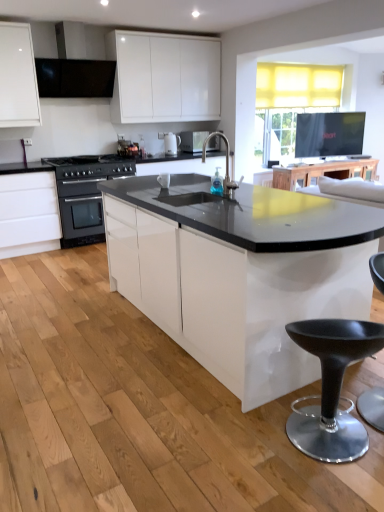
This screenshot has width=384, height=512. Describe the element at coordinates (85, 194) in the screenshot. I see `black stainless steel oven at left` at that location.

The image size is (384, 512). What do you see at coordinates (74, 68) in the screenshot?
I see `black matte exhaust hood at upper left` at bounding box center [74, 68].

I want to click on black plastic stool at lower right, so click(x=332, y=388).

Find the location of a particular element. The image size is (384, 512). white glossy cabinet at left is located at coordinates (28, 214).

Describe the element at coordinates (170, 143) in the screenshot. I see `white glossy coffee machine at center` at that location.

Image resolution: width=384 pixels, height=512 pixels. I want to click on white glossy coffee machine at center, so click(170, 143).

Describe the element at coordinates (226, 163) in the screenshot. I see `translucent glass faucet at center` at that location.

Identify the location of black stainless steel oven at left. (85, 194).

Is translucent glass faucet at center next to wooden table at upper center?

No.

From a real-world perspective, does translucent glass faucet at center stand above wooden table at upper center?

Indeed, from a real-world perspective, translucent glass faucet at center stands above wooden table at upper center.

In the scene shown: Considering the relative positions of translucent glass faucet at center and wooden table at upper center in the image provided, is translucent glass faucet at center to the left or to the right of wooden table at upper center?

translucent glass faucet at center is positioned on wooden table at upper center's left side.

Could you tell me if translucent glass faucet at center is turned towards wooden table at upper center?

No, translucent glass faucet at center is not turned towards wooden table at upper center.

From a real-world perspective, between black stainless steel oven at left and black plastic stool at lower right, who is vertically lower?

black plastic stool at lower right is physically lower.

Is black stainless steel oven at left oriented towards black plastic stool at lower right?

Yes, black stainless steel oven at left is turned towards black plastic stool at lower right.

Is black stainless steel oven at left not inside black plastic stool at lower right?

Absolutely, black stainless steel oven at left is external to black plastic stool at lower right.

Does black stainless steel oven at left come behind black plastic stool at lower right?

Yes.

Based on the photo, from a real-world perspective, which is physically above, black matte exhaust hood at upper left or wooden table at upper center?

black matte exhaust hood at upper left.

Is black matte exhaust hood at upper left far from wooden table at upper center?

Yes.

Which is in front, black matte exhaust hood at upper left or wooden table at upper center?

black matte exhaust hood at upper left is more forward.

From the image's perspective, which one is positioned higher, black matte exhaust hood at upper left or wooden table at upper center?

From the image's view, black matte exhaust hood at upper left is above.

Can you tell me how much black plastic swivel chair at lower right and white glossy coffee machine at center differ in facing direction?

black plastic swivel chair at lower right and white glossy coffee machine at center are facing 22.9 degrees away from each other.

Based on their sizes in the image, would you say black plastic swivel chair at lower right is bigger or smaller than white glossy coffee machine at center?

Clearly, black plastic swivel chair at lower right is larger in size than white glossy coffee machine at center.

Considering the sizes of objects black plastic swivel chair at lower right and white glossy coffee machine at center in the image provided, who is wider, black plastic swivel chair at lower right or white glossy coffee machine at center?

black plastic swivel chair at lower right is wider.

This screenshot has height=512, width=384. In the image, there is a black plastic swivel chair at lower right. In order to click on coffee machine above it (from the image's perspective) in this screenshot , I will do `click(170, 143)`.

Which of these two, translucent glass faucet at center or white glossy cabinet at left, is wider?

With larger width is white glossy cabinet at left.

From a real-world perspective, which is physically below, translucent glass faucet at center or white glossy cabinet at left?

In real-world perspective, white glossy cabinet at left is lower.

Which is correct: translucent glass faucet at center is inside white glossy cabinet at left, or outside of it?

translucent glass faucet at center cannot be found inside white glossy cabinet at left.

In terms of size, does translucent glass faucet at center appear bigger or smaller than white glossy cabinet at left?

Clearly, translucent glass faucet at center is smaller in size than white glossy cabinet at left.

From a real-world perspective, is white glossy coffee machine at center positioned under matte black microwave at center based on gravity?

Incorrect, from a real-world perspective, white glossy coffee machine at center is higher than matte black microwave at center.

Does white glossy coffee machine at center have a greater width compared to matte black microwave at center?

Incorrect, the width of white glossy coffee machine at center does not surpass that of matte black microwave at center.

Is white glossy coffee machine at center turned away from matte black microwave at center?

No, white glossy coffee machine at center is not facing the opposite direction of matte black microwave at center.

Would you say white glossy coffee machine at center is outside matte black microwave at center?

Yes.

Is black stainless steel oven at left positioned with its back to wooden table at upper center?

No, black stainless steel oven at left is not facing the opposite direction of wooden table at upper center.

Does point (65, 203) come behind point (342, 169)?

No, it is not.

From the image's perspective, is black stainless steel oven at left beneath wooden table at upper center?

Yes, from the image's perspective, black stainless steel oven at left is beneath wooden table at upper center.

The height and width of the screenshot is (512, 384). Find the location of `open lying on the left of wooden table at upper center`. open lying on the left of wooden table at upper center is located at coordinates (226, 163).

Identify the location of bar stool below the black stainless steel oven at left (from the image's perspective). (332, 388).

Estimate the real-world distances between objects in this image. Which object is further from black plastic swivel chair at lower right, white glossy cabinet at left or matte black microwave at center?

matte black microwave at center is positioned further to the anchor black plastic swivel chair at lower right.

Based on their spatial positions, is black plastic stool at lower right or matte black microwave at center closer to black plastic swivel chair at lower right?

black plastic stool at lower right is closer to black plastic swivel chair at lower right.

Looking at the image, which one is located further to black matte exhaust hood at upper left, translucent glass faucet at center or white glossy cabinet at left?

translucent glass faucet at center.

Based on the photo, considering their positions, is matte black microwave at center positioned closer to white glossy cabinet at left than black plastic stool at lower right?

Based on the image, matte black microwave at center appears to be nearer to white glossy cabinet at left.

When comparing their distances from white glossy coffee machine at center, does black plastic swivel chair at lower right or wooden table at upper center seem closer?

The object closer to white glossy coffee machine at center is wooden table at upper center.

When comparing their distances from wooden table at upper center, does black matte exhaust hood at upper left or matte black microwave at center seem further?

black matte exhaust hood at upper left is positioned further to the anchor wooden table at upper center.

Considering their positions, is black stainless steel oven at left positioned closer to black plastic swivel chair at lower right than black matte exhaust hood at upper left?

black stainless steel oven at left.

Looking at this image, from the image, which object appears to be farther from white glossy coffee machine at center, translucent glass faucet at center or black plastic stool at lower right?

Based on the image, black plastic stool at lower right appears to be further to white glossy coffee machine at center.

Where is `appliance between black matte exhaust hood at upper left and wooden table at upper center from left to right`? The image size is (384, 512). appliance between black matte exhaust hood at upper left and wooden table at upper center from left to right is located at coordinates (192, 141).

The width and height of the screenshot is (384, 512). What are the coordinates of `cabinetry located between black plastic stool at lower right and wooden table at upper center in the depth direction` in the screenshot? It's located at (28, 214).

The height and width of the screenshot is (512, 384). Identify the location of swivel chair positioned between black plastic stool at lower right and white glossy coffee machine at center from near to far. (372, 407).

Identify the location of kitchen appliance between black plastic swivel chair at lower right and wooden table at upper center in the front-back direction. Image resolution: width=384 pixels, height=512 pixels. (85, 194).